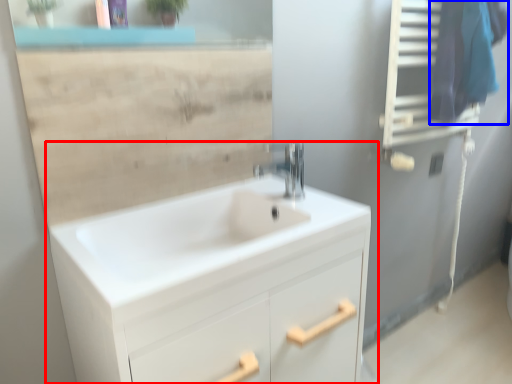
Question: Which object appears closest to the camera in this image, bathroom cabinet (highlighted by a red box) or laundry (highlighted by a blue box)?

Choices:
 (A) bathroom cabinet
 (B) laundry

Answer: (A)